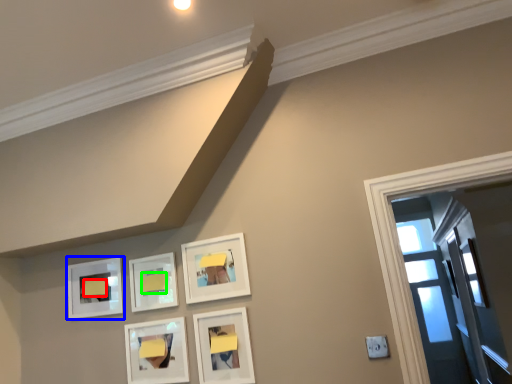
Question: Which object is positioned closest to furniture (highlighted by a red box)? Select from picture frame (highlighted by a blue box) and furniture (highlighted by a green box).

Choices:
 (A) picture frame
 (B) furniture

Answer: (A)